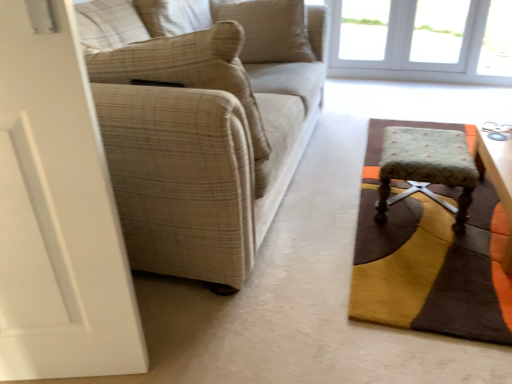
Question: Would you say beige textured pillow at left, which is the 2th pillow in top-to-bottom order, is part of beige plaid fabric couch at left's contents?

Choices:
 (A) yes
 (B) no

Answer: (A)

Question: From a real-world perspective, is beige plaid fabric couch at left on top of beige textured pillow at left, which is the 2th pillow in top-to-bottom order?

Choices:
 (A) yes
 (B) no

Answer: (B)

Question: Does beige plaid fabric couch at left have a larger size compared to beige textured pillow at left, which appears as the 2th pillow when viewed from the back?

Choices:
 (A) yes
 (B) no

Answer: (A)

Question: Is beige plaid fabric couch at left taller than beige textured pillow at left, which is the 1th pillow from bottom to top?

Choices:
 (A) no
 (B) yes

Answer: (B)

Question: From the image's perspective, is beige plaid fabric couch at left under beige textured pillow at left, which is the 1th pillow from bottom to top?

Choices:
 (A) yes
 (B) no

Answer: (B)

Question: Considering their positions, is white glass window at upper right located in front of or behind wooden round table at right?

Choices:
 (A) front
 (B) behind

Answer: (B)

Question: Is white glass window at upper right taller or shorter than wooden round table at right?

Choices:
 (A) short
 (B) tall

Answer: (B)

Question: In terms of size, does white glass window at upper right appear bigger or smaller than wooden round table at right?

Choices:
 (A) big
 (B) small

Answer: (A)

Question: Is white glass window at upper right spatially inside wooden round table at right, or outside of it?

Choices:
 (A) inside
 (B) outside

Answer: (B)

Question: Is beige plaid fabric couch at left in front of or behind beige textured pillow at left, which is the 2th pillow in top-to-bottom order, in the image?

Choices:
 (A) behind
 (B) front

Answer: (B)

Question: In the image, is beige plaid fabric couch at left on the left side or the right side of beige textured pillow at left, which is the 1th pillow from bottom to top?

Choices:
 (A) left
 (B) right

Answer: (B)

Question: Considering the positions of point (142, 223) and point (108, 54), is point (142, 223) closer or farther from the camera than point (108, 54)?

Choices:
 (A) closer
 (B) farther

Answer: (B)

Question: From the image's perspective, is beige plaid fabric couch at left located above or below beige textured pillow at left, which is the 2th pillow in top-to-bottom order?

Choices:
 (A) above
 (B) below

Answer: (A)

Question: From a real-world perspective, is beige textured pillow at upper center, which appears as the second pillow when viewed from the front, positioned above or below floral fabric stool at lower right?

Choices:
 (A) above
 (B) below

Answer: (A)

Question: Based on their positions, is beige textured pillow at upper center, which is the first pillow from top to bottom, located to the left or right of floral fabric stool at lower right?

Choices:
 (A) right
 (B) left

Answer: (B)